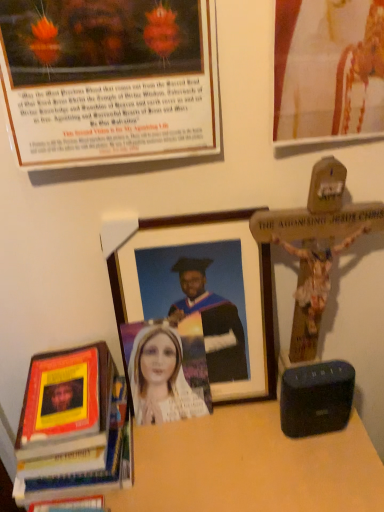
This screenshot has height=512, width=384. I want to click on empty space that is ontop of wooden table at lower center (from a real-world perspective), so click(205, 453).